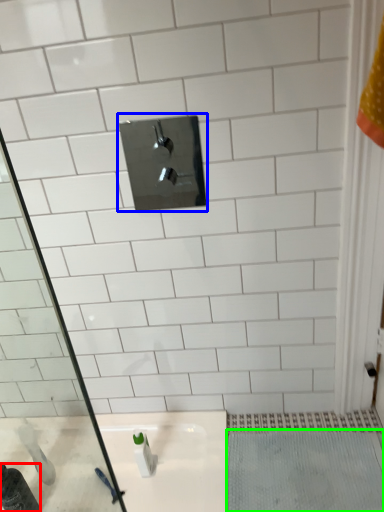
Question: Estimate the real-world distances between objects in this image. Which object is farther from bottle (highlighted by a red box), tap (highlighted by a blue box) or bath mat (highlighted by a green box)?

Choices:
 (A) tap
 (B) bath mat

Answer: (A)